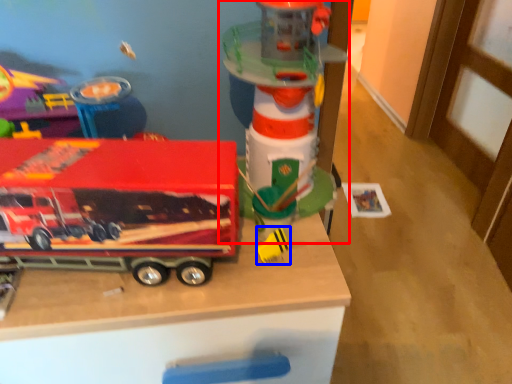
Question: Which point is closer to the camera, toy (highlighted by a red box) or toy (highlighted by a blue box)?

Choices:
 (A) toy
 (B) toy

Answer: (A)